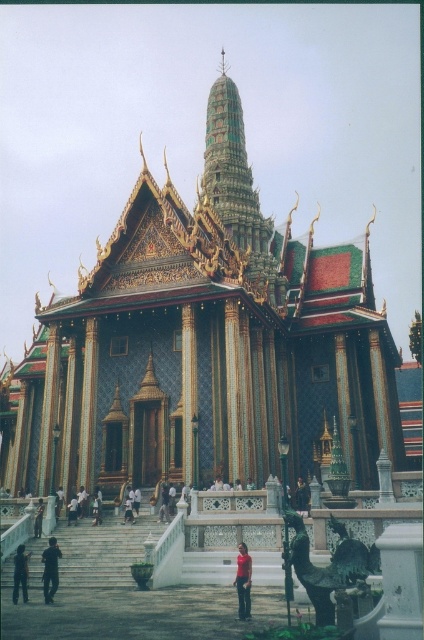
You are a visitor at the temple and want to take a photo of the dark blue fabric at center and the light brown leather jacket at lower center. Which object should you focus on first if you want to capture both in one frame without moving the camera?

You should focus on the light brown leather jacket at lower center first because it is taller than the dark blue fabric at center, so it will be easier to ensure both are in frame by centering on the taller object.

You are a tourist standing in front of the temple and want to take a photo of your friend wearing the red matte shirt at lower center and dark blue jeans at lower left. Which part of your friend should appear closer to the camera in the photo?

The red matte shirt at lower center will appear closer to the camera in the photo because it is closer to the viewer than the dark blue jeans at lower left.

You are standing in front of the grand temple and notice two points marked on the temple facade. One is at coordinates point (166, 504) and the other at point (130, 508). Which point is closer to you?

Point (166, 504) is closer to the viewer than point (130, 508).